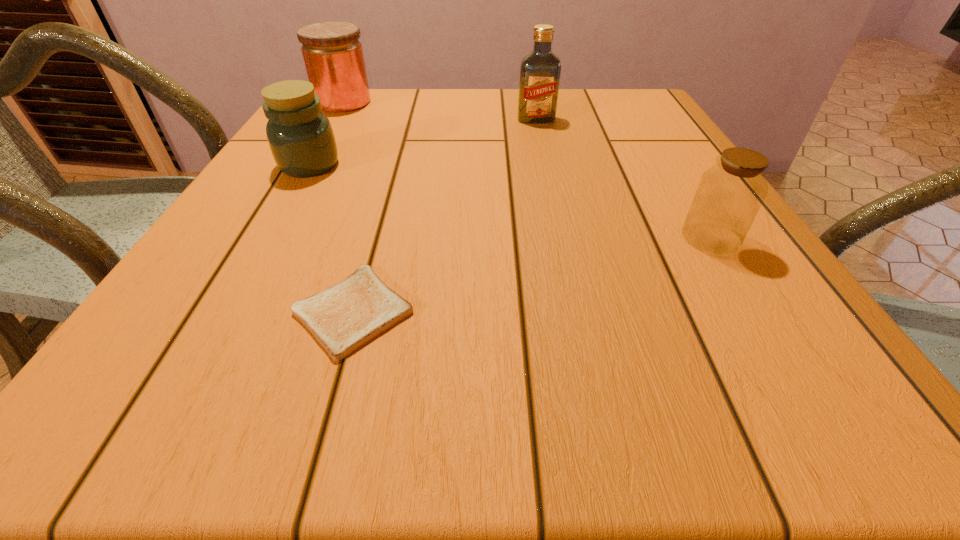
The width and height of the screenshot is (960, 540). I want to click on the fourth nearest object, so pyautogui.click(x=540, y=70).

The height and width of the screenshot is (540, 960). Identify the location of the fourth object from left to right. (540, 70).

What are the coordinates of `the farthest object` in the screenshot? It's located at (333, 56).

At what (x,y) coordinates should I click in order to perform the action: click on the second farthest jar. Please return your answer as a coordinate pair (x, y). The width and height of the screenshot is (960, 540). Looking at the image, I should click on (300, 136).

Image resolution: width=960 pixels, height=540 pixels. Identify the location of the rightmost object. (730, 193).

Identify the location of the fourth farthest object. (730, 193).

Where is `the shortest object`? The width and height of the screenshot is (960, 540). the shortest object is located at coordinates (347, 315).

This screenshot has height=540, width=960. In order to click on toast in this screenshot , I will do `click(347, 315)`.

At what (x,y) coordinates should I click in order to perform the action: click on blank space located on the front-facing side of the tallest object. Please return your answer as a coordinate pair (x, y). Looking at the image, I should click on (549, 179).

Identify the location of free space located on the front of the farthest object. (302, 172).